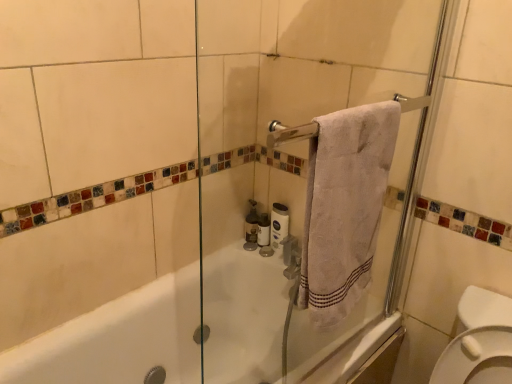
Question: Can you confirm if white cotton towel at upper right is taller than white matte toilet paper at center, which ranks as the first toilet paper in left-to-right order?

Choices:
 (A) no
 (B) yes

Answer: (B)

Question: Can you confirm if white cotton towel at upper right is positioned to the right of white matte toilet paper at center, marked as the second toilet paper in a right-to-left arrangement?

Choices:
 (A) no
 (B) yes

Answer: (B)

Question: Can you confirm if white cotton towel at upper right is thinner than white matte toilet paper at center, marked as the second toilet paper in a right-to-left arrangement?

Choices:
 (A) yes
 (B) no

Answer: (B)

Question: Is white matte toilet paper at center, which ranks as the first toilet paper in left-to-right order, a part of white cotton towel at upper right?

Choices:
 (A) no
 (B) yes

Answer: (A)

Question: Does white cotton towel at upper right lie in front of white matte toilet paper at center, which ranks as the first toilet paper in left-to-right order?

Choices:
 (A) no
 (B) yes

Answer: (B)

Question: In the image, is white matte toilet paper at center, marked as the second toilet paper in a right-to-left arrangement, positioned in front of or behind white cotton towel at upper right?

Choices:
 (A) front
 (B) behind

Answer: (B)

Question: Based on their positions, is white matte toilet paper at center, marked as the second toilet paper in a right-to-left arrangement, located to the left or right of white cotton towel at upper right?

Choices:
 (A) left
 (B) right

Answer: (A)

Question: From a real-world perspective, is white matte toilet paper at center, marked as the second toilet paper in a right-to-left arrangement, above or below white cotton towel at upper right?

Choices:
 (A) below
 (B) above

Answer: (A)

Question: Is white matte toilet paper at center, marked as the second toilet paper in a right-to-left arrangement, wider or thinner than white cotton towel at upper right?

Choices:
 (A) thin
 (B) wide

Answer: (A)

Question: Is white matte toilet paper at center, the 2th toilet paper positioned from the left, in front of or behind white matte toilet paper at center, marked as the second toilet paper in a right-to-left arrangement, in the image?

Choices:
 (A) front
 (B) behind

Answer: (A)

Question: From the image's perspective, is white matte toilet paper at center, which is the first toilet paper in right-to-left order, positioned above or below white matte toilet paper at center, marked as the second toilet paper in a right-to-left arrangement?

Choices:
 (A) below
 (B) above

Answer: (B)

Question: Would you say white matte toilet paper at center, the 2th toilet paper positioned from the left, is inside or outside white matte toilet paper at center, marked as the second toilet paper in a right-to-left arrangement?

Choices:
 (A) outside
 (B) inside

Answer: (A)

Question: Is white matte toilet paper at center, which is the first toilet paper in right-to-left order, bigger or smaller than white matte toilet paper at center, which ranks as the first toilet paper in left-to-right order?

Choices:
 (A) big
 (B) small

Answer: (A)

Question: Is matte glass soap dispenser at center in front of or behind white matte toilet paper at center, marked as the second toilet paper in a right-to-left arrangement, in the image?

Choices:
 (A) front
 (B) behind

Answer: (B)

Question: Looking at their shapes, would you say matte glass soap dispenser at center is wider or thinner than white matte toilet paper at center, marked as the second toilet paper in a right-to-left arrangement?

Choices:
 (A) wide
 (B) thin

Answer: (A)